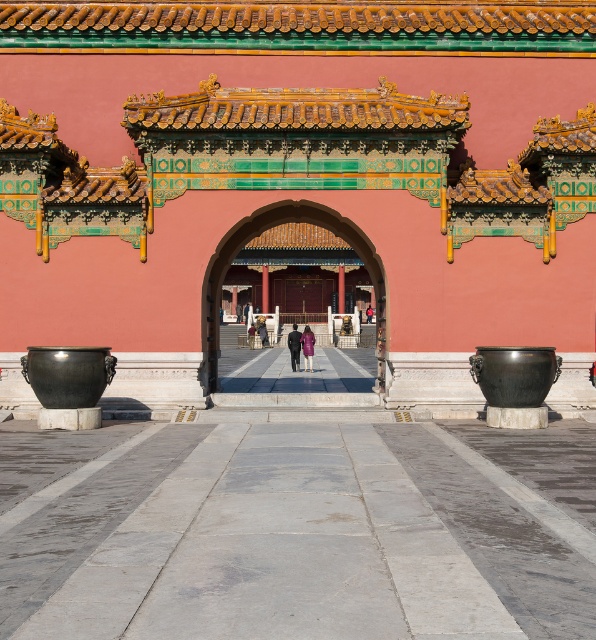
You are standing at the entrance of the gate and want to walk towards the point labeled as point (291, 368). However, there is an obstacle at point (303, 336). Can you safely walk around the obstacle to reach your destination?

Point (303, 336) is in front of point (291, 368), so the obstacle is blocking the direct path. You can walk around the obstacle by moving to the side of the pathway to reach point (291, 368) safely.

You are standing in front of the traditional Chinese gate and want to take a photo. If your camera has a maximum zoom range of 10 meters, will you be able to capture the entire polished bronze gate at center in your photo without moving closer?

The distance of polished bronze gate at center from camera is 13.96 meters, which exceeds the camera maximum zoom range of 10 meters. Therefore, you will not be able to capture the entire polished bronze gate at center in your photo without moving closer.